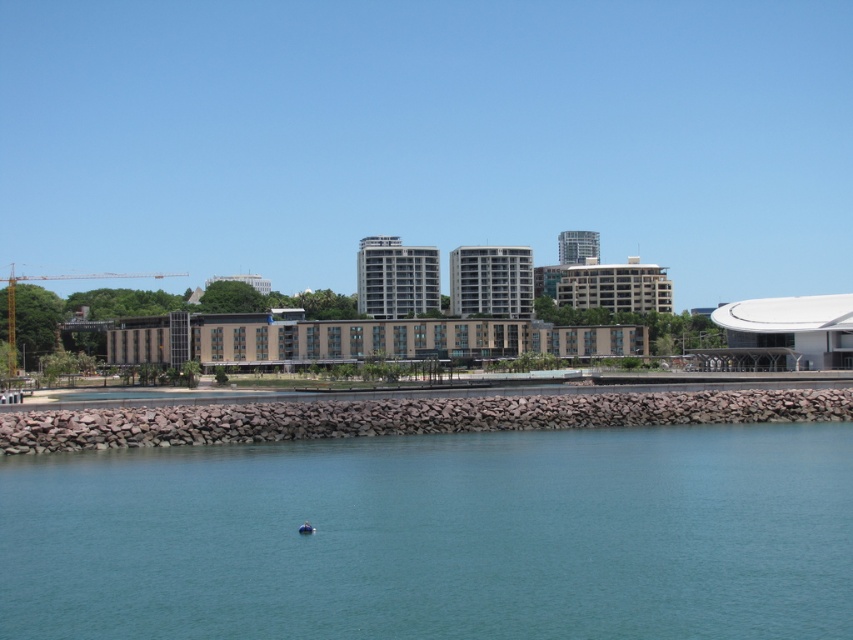
Does clear blue water at center appear over blue rubber boat at lower center?

Incorrect, clear blue water at center is not positioned above blue rubber boat at lower center.

Who is shorter, clear blue water at center or blue rubber boat at lower center?

Standing shorter between the two is blue rubber boat at lower center.

Locate an element on the screen. clear blue water at center is located at coordinates (438, 536).